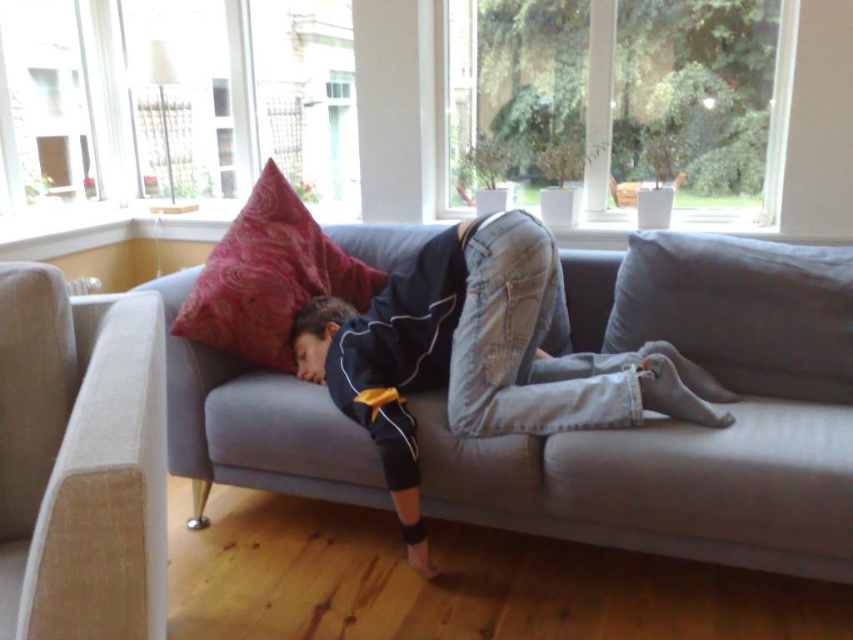
You are standing in the room and want to place a small table exactly at the point with coordinates point (439, 442). If the table is 3 feet wide, will it fit without overlapping any objects?

The distance of point (439, 442) from camera is 6.27 feet. Since the table is 3 feet wide, it will fit as long as there is enough space around the point. However, the description does not provide information about nearby objects, so we cannot confirm if it overlaps with anything.

You are a delivery person who needs to place a small package on the tallest object in the room. Based on the scene, which object should you choose between the matte gray couch at center and the velvet red pillow at upper left?

The matte gray couch at center is taller than the velvet red pillow at upper left, so you should place the package on the matte gray couch at center.